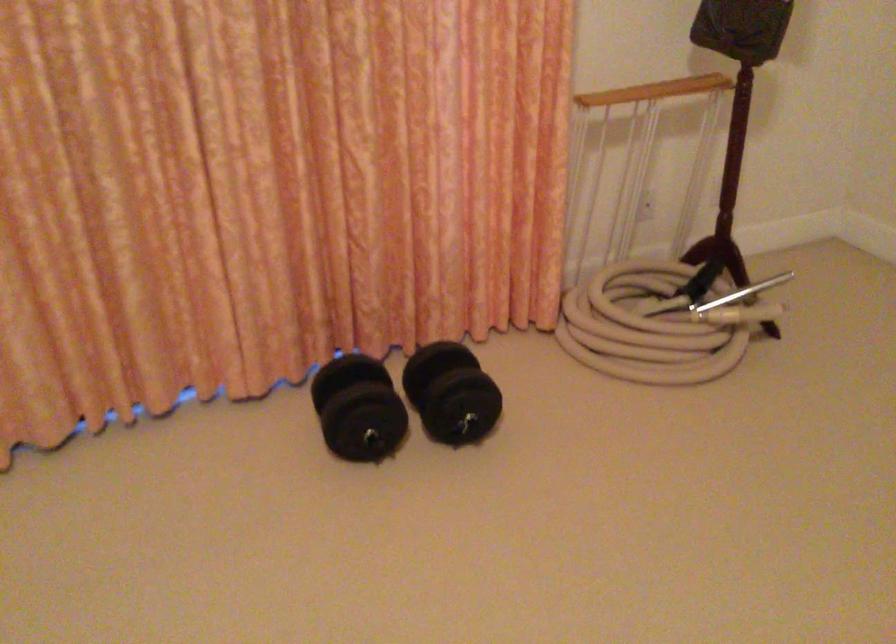
Find where to lift the rack wooden handle. Please return your answer as a coordinate pair (x, y).

(711, 78)